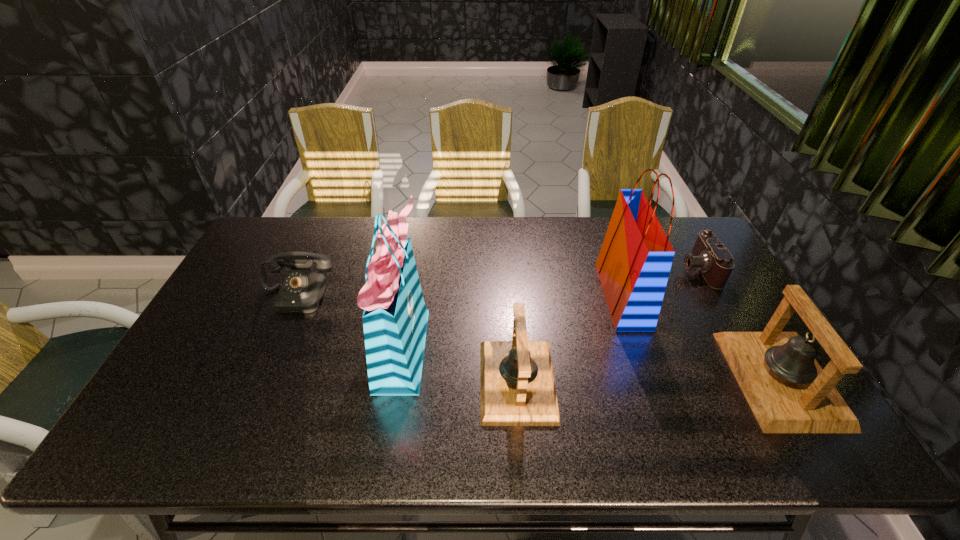
Find the location of a particular element. The width and height of the screenshot is (960, 540). free space located 0.230m on the left of the taller bell is located at coordinates (645, 379).

Where is `free spot located on the handle side of the right shopping bag`? The height and width of the screenshot is (540, 960). free spot located on the handle side of the right shopping bag is located at coordinates (472, 296).

Where is `free space located 0.270m on the handle side of the right shopping bag`? Image resolution: width=960 pixels, height=540 pixels. free space located 0.270m on the handle side of the right shopping bag is located at coordinates (515, 296).

You are a GUI agent. You are given a task and a screenshot of the screen. Output one action in this format:
    pyautogui.click(x=<x>, y=<y>)
    Task: Click on the vacant space positioned 0.110m on the handle side of the right shopping bag
    
    Given the screenshot: What is the action you would take?
    [x=567, y=296]

Find the location of a particular element. The height and width of the screenshot is (540, 960). vacant space situated on the front-facing side of the camera is located at coordinates (592, 269).

Locate an element on the screen. This screenshot has height=540, width=960. vacant area situated on the front-facing side of the camera is located at coordinates (636, 269).

Where is `vacant space located on the front-facing side of the camera`? The width and height of the screenshot is (960, 540). vacant space located on the front-facing side of the camera is located at coordinates (568, 269).

Locate an element on the screen. The width and height of the screenshot is (960, 540). free location located 0.190m on the dial of the fifth tallest object is located at coordinates (266, 367).

Identify the location of vacant space located 0.340m on the left of the left shopping bag. Image resolution: width=960 pixels, height=540 pixels. (255, 347).

Where is `object located at the far edge`? The height and width of the screenshot is (540, 960). object located at the far edge is located at coordinates (715, 262).